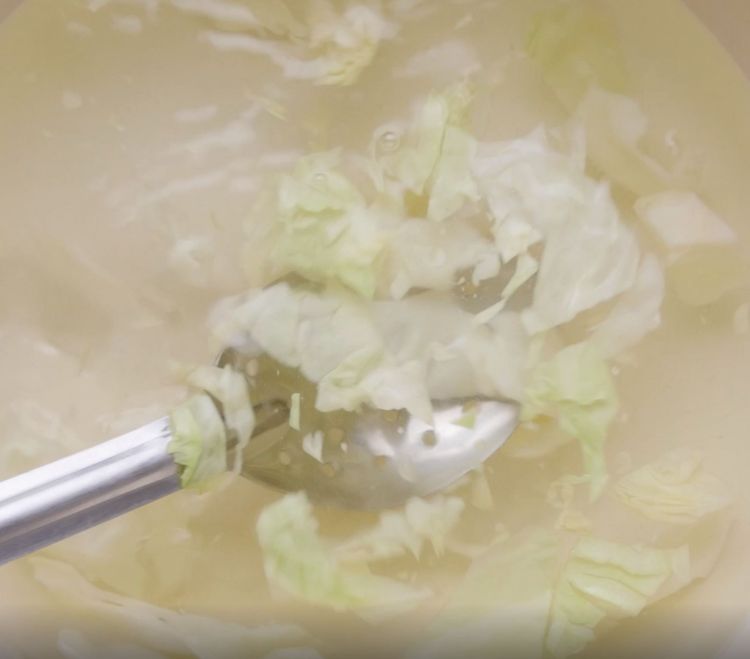
Where is `this spoon is often used in restaurants`? this spoon is often used in restaurants is located at coordinates (136, 467).